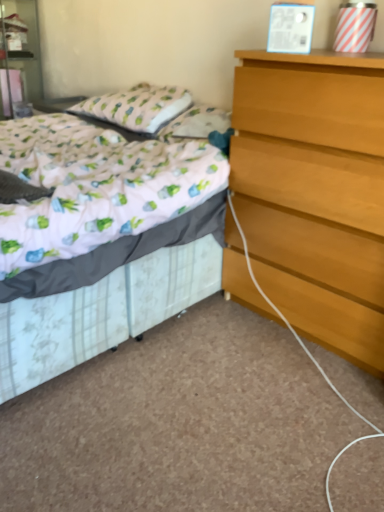
What is the approximate height of matte white nightstand at upper left?

The height of matte white nightstand at upper left is 33.78 inches.

Describe the element at coordinates (137, 106) in the screenshot. Image resolution: width=384 pixels, height=512 pixels. I see `patterned fabric pillow at upper left` at that location.

Describe the element at coordinates (315, 192) in the screenshot. I see `light brown wooden chest of drawers at right` at that location.

Find the location of a particular element. This screenshot has width=384, height=512. matte white nightstand at upper left is located at coordinates (27, 45).

Locate an element on the screen. nightstand above the white floral fabric bed at center (from a real-world perspective) is located at coordinates (27, 45).

Is white floral fabric bed at center in contact with matte white nightstand at upper left?

white floral fabric bed at center and matte white nightstand at upper left are not in contact.

What's the angular difference between white floral fabric bed at center and matte white nightstand at upper left's facing directions?

14.4 degrees.

Is matte white nightstand at upper left positioned with its back to white floral fabric bed at center?

matte white nightstand at upper left is not turned away from white floral fabric bed at center.

Does point (18, 67) come closer to viewer compared to point (58, 312)?

No.

This screenshot has width=384, height=512. What are the coordinates of `bed that is below the matte white nightstand at upper left (from the image's perspective)` in the screenshot? It's located at (103, 239).

Can you tell me how much light brown wooden chest of drawers at right and white floral fabric bed at center differ in facing direction?

The facing directions of light brown wooden chest of drawers at right and white floral fabric bed at center are 0.395 degrees apart.

From a real-world perspective, who is located higher, light brown wooden chest of drawers at right or white floral fabric bed at center?

light brown wooden chest of drawers at right.

Does light brown wooden chest of drawers at right appear on the right side of white floral fabric bed at center?

Indeed, light brown wooden chest of drawers at right is positioned on the right side of white floral fabric bed at center.

Could white floral fabric bed at center be considered to be inside light brown wooden chest of drawers at right?

No, white floral fabric bed at center is not surrounded by light brown wooden chest of drawers at right.

How many degrees apart are the facing directions of white floral fabric bed at center and patterned fabric pillow at upper left?

They differ by 3.65 degrees in their facing directions.

Would you say patterned fabric pillow at upper left is part of white floral fabric bed at center's contents?

Yes.

Considering the relative positions of white floral fabric bed at center and patterned fabric pillow at upper left in the image provided, is white floral fabric bed at center behind patterned fabric pillow at upper left?

No, white floral fabric bed at center is closer to the camera.

Does point (110, 338) appear closer or farther from the camera than point (97, 113)?

Point (110, 338) appears to be closer to the viewer than point (97, 113).

Is patterned fabric pillow at upper left bigger than light brown wooden chest of drawers at right?

Incorrect, patterned fabric pillow at upper left is not larger than light brown wooden chest of drawers at right.

From a real-world perspective, is patterned fabric pillow at upper left physically below light brown wooden chest of drawers at right?

No, from a real-world perspective, patterned fabric pillow at upper left is not beneath light brown wooden chest of drawers at right.

Considering the sizes of objects patterned fabric pillow at upper left and light brown wooden chest of drawers at right in the image provided, who is shorter, patterned fabric pillow at upper left or light brown wooden chest of drawers at right?

With less height is patterned fabric pillow at upper left.

Can you confirm if matte white nightstand at upper left is bigger than light brown wooden chest of drawers at right?

Incorrect, matte white nightstand at upper left is not larger than light brown wooden chest of drawers at right.

Does matte white nightstand at upper left appear on the right side of light brown wooden chest of drawers at right?

No, matte white nightstand at upper left is not to the right of light brown wooden chest of drawers at right.

In the scene shown: Does matte white nightstand at upper left have a greater width compared to light brown wooden chest of drawers at right?

Correct, the width of matte white nightstand at upper left exceeds that of light brown wooden chest of drawers at right.

How much distance is there between matte white nightstand at upper left and light brown wooden chest of drawers at right?

The distance of matte white nightstand at upper left from light brown wooden chest of drawers at right is 8.54 feet.

Could you tell me if white floral fabric bed at center is facing light brown wooden chest of drawers at right?

No, white floral fabric bed at center is not turned towards light brown wooden chest of drawers at right.

Considering the relative sizes of white floral fabric bed at center and light brown wooden chest of drawers at right in the image provided, is white floral fabric bed at center thinner than light brown wooden chest of drawers at right?

No.

Identify the location of the chest of drawers located above the white floral fabric bed at center (from a real-world perspective). Image resolution: width=384 pixels, height=512 pixels. (315, 192).

Is white floral fabric bed at center positioned beyond the bounds of light brown wooden chest of drawers at right?

white floral fabric bed at center lies outside light brown wooden chest of drawers at right's area.

Find the location of a particular element. nightstand that appears above the white floral fabric bed at center (from the image's perspective) is located at coordinates (27, 45).

Identify the location of bed that is under the matte white nightstand at upper left (from a real-world perspective). The width and height of the screenshot is (384, 512). (103, 239).

From the image, which object appears to be nearer to patterned fabric pillow at upper left, matte white nightstand at upper left or white floral fabric bed at center?

white floral fabric bed at center.

Looking at this image, which object lies further to the anchor point light brown wooden chest of drawers at right, white floral fabric bed at center or patterned fabric pillow at upper left?

patterned fabric pillow at upper left is positioned further to the anchor light brown wooden chest of drawers at right.

Estimate the real-world distances between objects in this image. Which object is closer to white floral fabric bed at center, patterned fabric pillow at upper left or matte white nightstand at upper left?

Based on the image, patterned fabric pillow at upper left appears to be nearer to white floral fabric bed at center.

Estimate the real-world distances between objects in this image. Which object is further from light brown wooden chest of drawers at right, matte white nightstand at upper left or white floral fabric bed at center?

Based on the image, matte white nightstand at upper left appears to be further to light brown wooden chest of drawers at right.

Looking at the image, which one is located closer to patterned fabric pillow at upper left, white floral fabric bed at center or light brown wooden chest of drawers at right?

white floral fabric bed at center is closer to patterned fabric pillow at upper left.

Looking at the image, which one is located further to white floral fabric bed at center, patterned fabric pillow at upper left or light brown wooden chest of drawers at right?

patterned fabric pillow at upper left.

Considering their positions, is white floral fabric bed at center positioned closer to patterned fabric pillow at upper left than matte white nightstand at upper left?

white floral fabric bed at center is positioned closer to the anchor patterned fabric pillow at upper left.

Looking at the image, which one is located closer to matte white nightstand at upper left, patterned fabric pillow at upper left or white floral fabric bed at center?

Among the two, patterned fabric pillow at upper left is located nearer to matte white nightstand at upper left.

The height and width of the screenshot is (512, 384). I want to click on the chest of drawers positioned between white floral fabric bed at center and matte white nightstand at upper left from near to far, so click(315, 192).

The height and width of the screenshot is (512, 384). I want to click on the chest of drawers located between white floral fabric bed at center and patterned fabric pillow at upper left in the depth direction, so [315, 192].

This screenshot has height=512, width=384. What are the coordinates of `pillow between white floral fabric bed at center and matte white nightstand at upper left along the z-axis` in the screenshot? It's located at (137, 106).

Find the location of a particular element. This screenshot has width=384, height=512. pillow situated between matte white nightstand at upper left and light brown wooden chest of drawers at right from left to right is located at coordinates (137, 106).